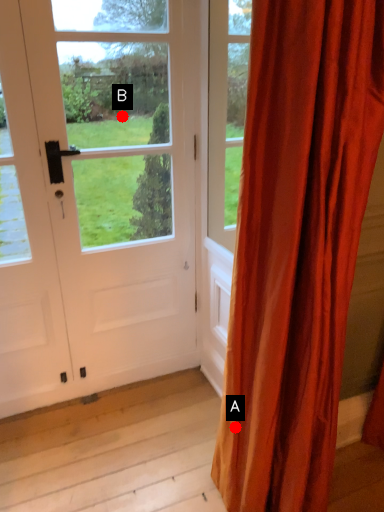
Question: Two points are circled on the image, labeled by A and B beside each circle. Which point is closer to the camera?

Choices:
 (A) A is closer
 (B) B is closer

Answer: (A)